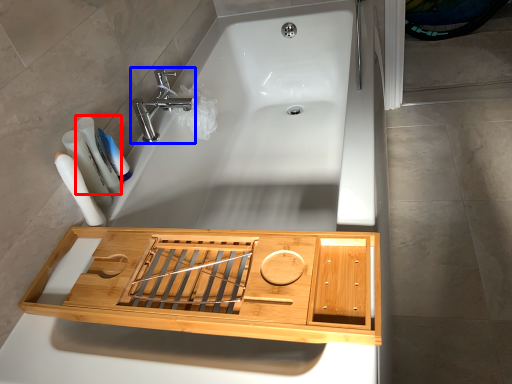
Question: Among these objects, which one is farthest to the camera, toiletry (highlighted by a red box) or tap (highlighted by a blue box)?

Choices:
 (A) toiletry
 (B) tap

Answer: (B)